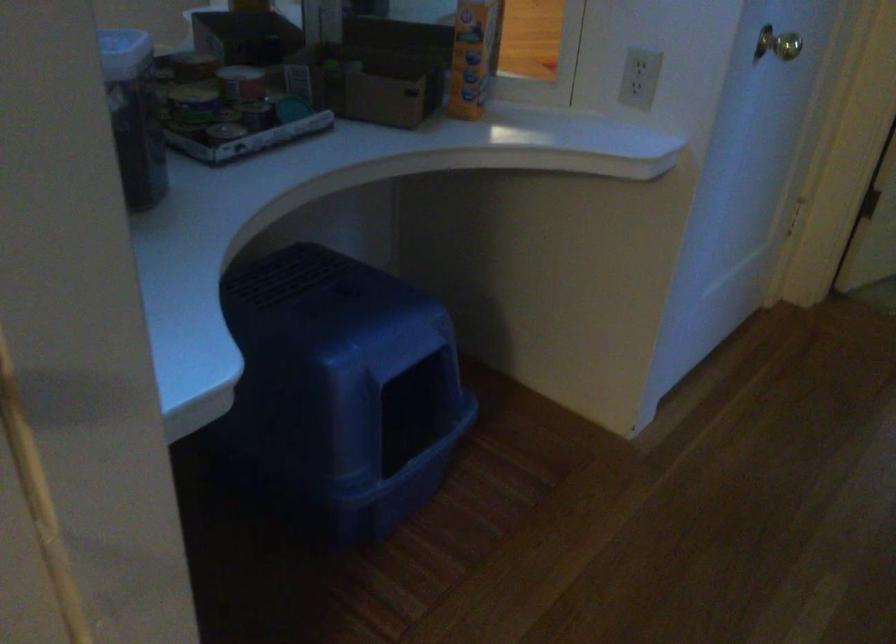
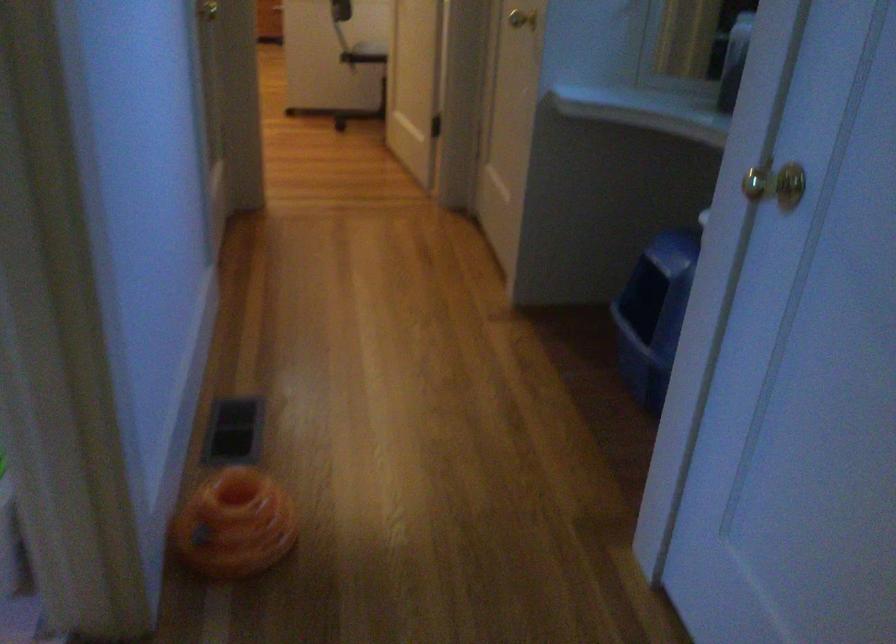
The point at (x=314, y=529) is marked in the first image. Where is the corresponding point in the second image?

(655, 314)